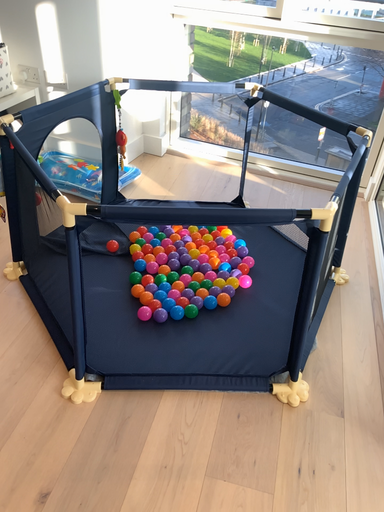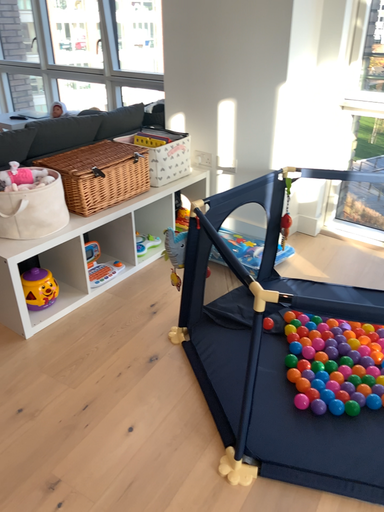
Question: Which way did the camera rotate in the video?

Choices:
 (A) rotated downward
 (B) rotated upward

Answer: (B)